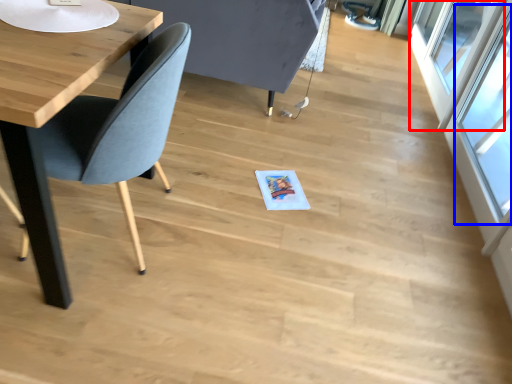
Question: Which object is further to the camera taking this photo, window (highlighted by a red box) or window (highlighted by a blue box)?

Choices:
 (A) window
 (B) window

Answer: (A)